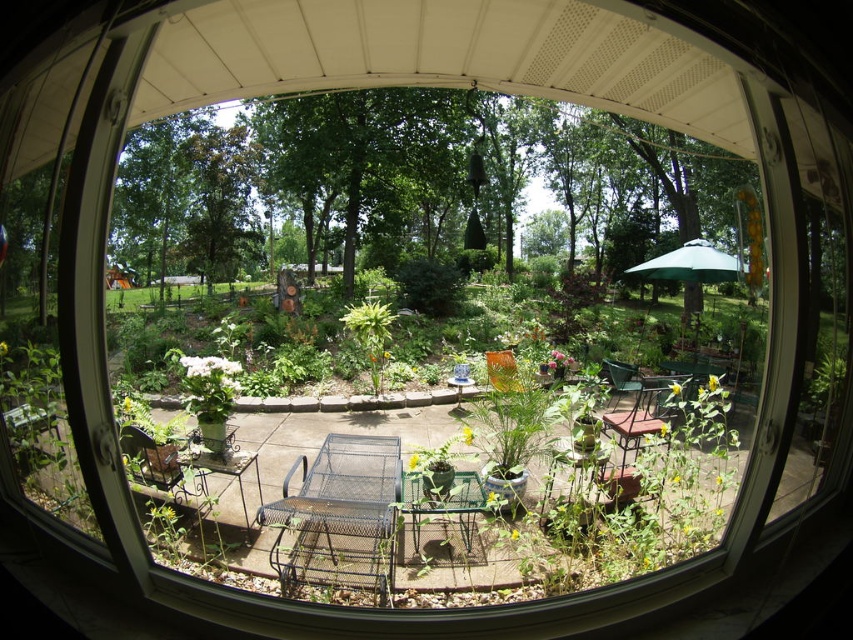
Based on the photo, you are standing inside a house looking through a curved window. You see a metallic brown chair at lower left and a brown metal chair at center. Which chair is closer to you?

The metallic brown chair at lower left is closer to you because it is positioned below the brown metal chair at center, indicating it is lower in the scene and thus nearer to the viewer.

You are sitting in the orange fabric chair at center and want to move to the green metal chair at center. Which direction should you move to reach it?

The orange fabric chair at center is positioned on the left side of green metal chair at center, so you should move to the right to reach it.

You are standing inside a house looking through a curved window. You see a green wire chair at center and a metallic brown chair at lower left. Which chair is closer to the window?

The green wire chair at center is closer to the window because it is located below the metallic brown chair at lower left, meaning it is positioned in front of it from the viewer perspective.